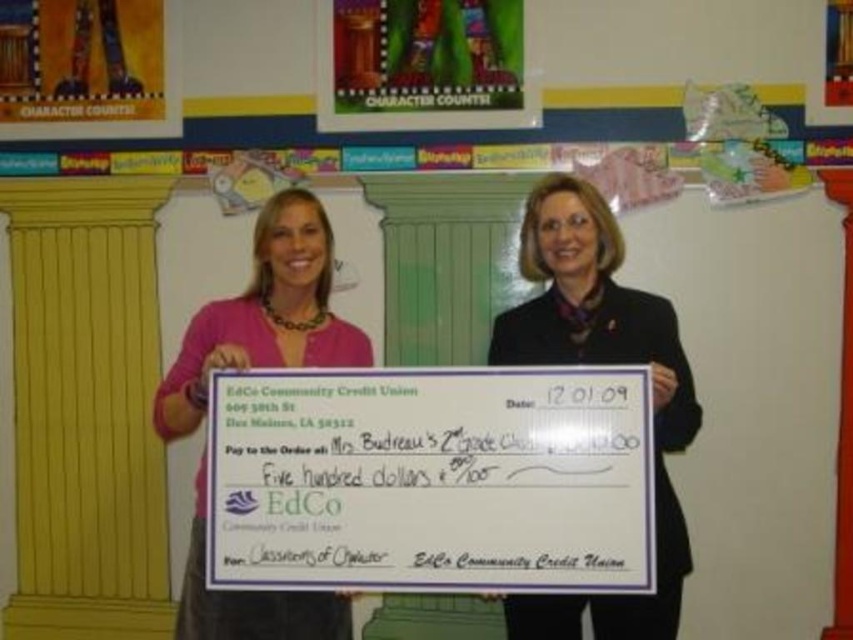
You are an observer standing in front of the two women holding the ceremonial check. Which clothing item is closer to you, the black fabric coat at center or the pink fabric shirt at center?

The black fabric coat at center is closer to you because it is in front of the pink fabric shirt at center.

You are organizing a charity event and need to decide which of the two garments displayed in the image can accommodate more layers underneath. Based on their sizes, which garment would allow for more layers? Please refer to the black fabric coat at center and the pink fabric shirt at center.

The black fabric coat at center has a larger size compared to the pink fabric shirt at center, so it can accommodate more layers underneath.